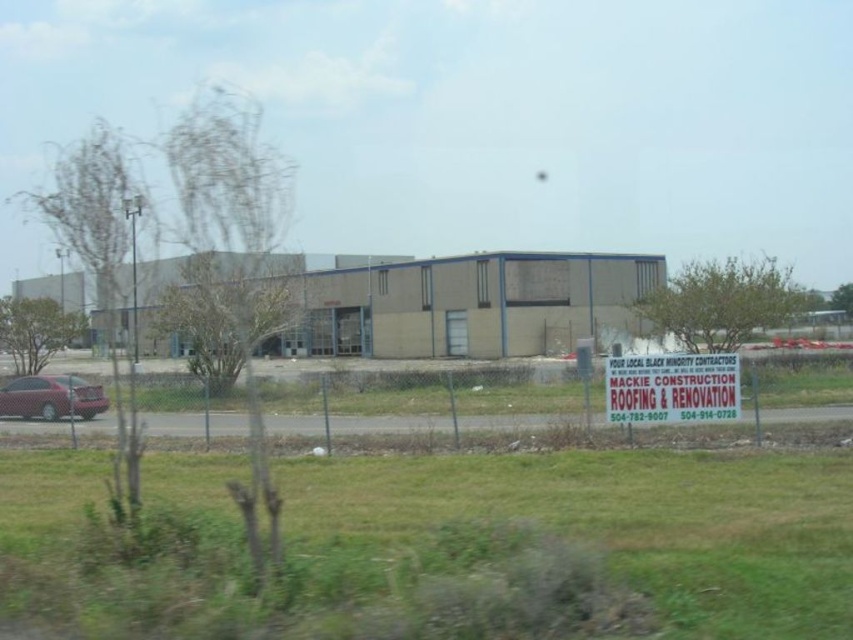
Who is positioned more to the right, white paper sign at center or matte red car at left?

white paper sign at center is more to the right.

Locate an element on the screen. The width and height of the screenshot is (853, 640). white paper sign at center is located at coordinates (672, 387).